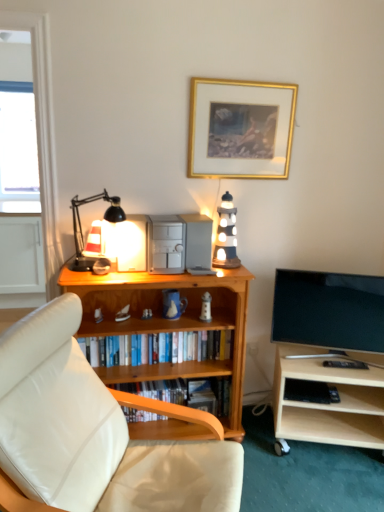
Question: Is wooden bookshelf at center, which is the 1th book in bottom-to-top order, far from transparent glass window at upper left?

Choices:
 (A) no
 (B) yes

Answer: (B)

Question: From the image's perspective, is wooden bookshelf at center, the third book when ordered from top to bottom, beneath transparent glass window at upper left?

Choices:
 (A) no
 (B) yes

Answer: (B)

Question: Are wooden bookshelf at center, which is the 1th book in bottom-to-top order, and transparent glass window at upper left making contact?

Choices:
 (A) no
 (B) yes

Answer: (A)

Question: Is wooden bookshelf at center, which is the 1th book in bottom-to-top order, oriented away from transparent glass window at upper left?

Choices:
 (A) no
 (B) yes

Answer: (A)

Question: Can you confirm if wooden bookshelf at center, the third book when ordered from top to bottom, is bigger than transparent glass window at upper left?

Choices:
 (A) no
 (B) yes

Answer: (A)

Question: From the image's perspective, is wooden bookshelf at center, the 3th book when ordered from bottom to top, located above or below wooden bookshelf at center, the third book when ordered from top to bottom?

Choices:
 (A) below
 (B) above

Answer: (B)

Question: From a real-world perspective, relative to wooden bookshelf at center, the third book when ordered from top to bottom, is wooden bookshelf at center, the first book from the top, vertically above or below?

Choices:
 (A) below
 (B) above

Answer: (B)

Question: In the image, is wooden bookshelf at center, the first book from the top, on the left side or the right side of wooden bookshelf at center, which is the 1th book in bottom-to-top order?

Choices:
 (A) right
 (B) left

Answer: (B)

Question: Is point (107, 348) closer or farther from the camera than point (139, 394)?

Choices:
 (A) closer
 (B) farther

Answer: (A)

Question: From their relative heights in the image, would you say white leather studio couch at lower left is taller or shorter than light wood tv stand at lower right?

Choices:
 (A) tall
 (B) short

Answer: (A)

Question: Looking at their shapes, would you say white leather studio couch at lower left is wider or thinner than light wood tv stand at lower right?

Choices:
 (A) wide
 (B) thin

Answer: (A)

Question: Does point (1, 382) appear closer or farther from the camera than point (352, 379)?

Choices:
 (A) farther
 (B) closer

Answer: (B)

Question: From a real-world perspective, relative to light wood tv stand at lower right, is white leather studio couch at lower left vertically above or below?

Choices:
 (A) above
 (B) below

Answer: (A)

Question: Considering the positions of point (226, 199) and point (120, 364), is point (226, 199) closer or farther from the camera than point (120, 364)?

Choices:
 (A) farther
 (B) closer

Answer: (A)

Question: Considering the positions of wooden lighthouse at center and wooden bookshelf at center, the 3th book when ordered from bottom to top, in the image, is wooden lighthouse at center wider or thinner than wooden bookshelf at center, the 3th book when ordered from bottom to top,?

Choices:
 (A) thin
 (B) wide

Answer: (A)